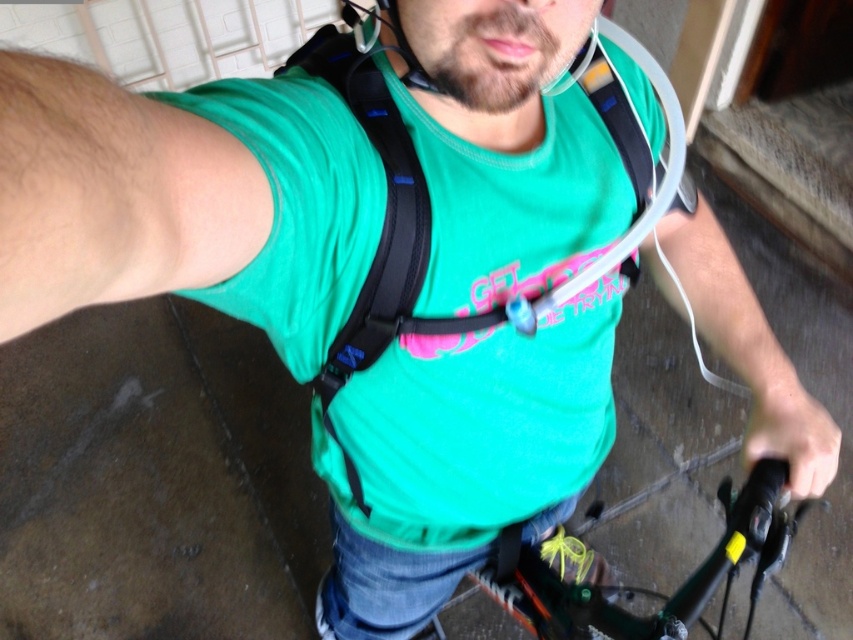
Is the position of black matte handlebar grip at lower right less distant than that of matte black helmet at upper center?

No.

Is point (770, 404) more distant than point (389, 13)?

Yes.

The image size is (853, 640). I want to click on black matte handlebar grip at lower right, so click(x=791, y=433).

Who is taller, black fabric strap at center or matte black helmet at upper center?

black fabric strap at center is taller.

Between black fabric strap at center and matte black helmet at upper center, which one appears on the left side from the viewer's perspective?

Positioned to the left is matte black helmet at upper center.

The image size is (853, 640). Describe the element at coordinates (381, 236) in the screenshot. I see `black fabric strap at center` at that location.

Where is `black fabric strap at center`? black fabric strap at center is located at coordinates (381, 236).

Is black fabric strap at center positioned in front of green matte bicycle handlebars at lower center?

That is True.

Does black fabric strap at center have a lesser width compared to green matte bicycle handlebars at lower center?

No.

Find the location of `black fabric strap at center`. black fabric strap at center is located at coordinates (381, 236).